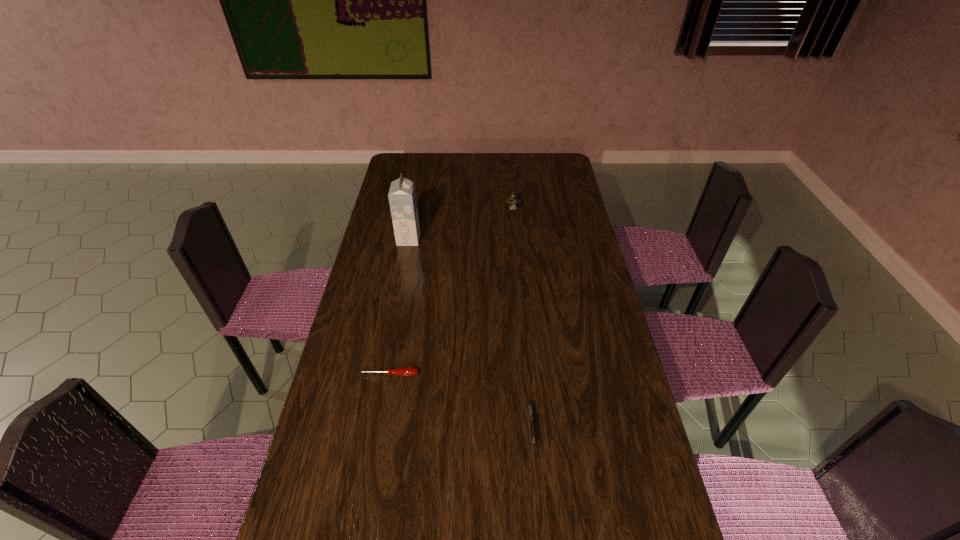
The width and height of the screenshot is (960, 540). In order to click on free space between the farthest object and the nearest object in this screenshot , I will do `click(522, 322)`.

This screenshot has width=960, height=540. Find the location of `free space between the screwdriver and the snail`. free space between the screwdriver and the snail is located at coordinates (451, 292).

I want to click on free space between the nearest object and the screwdriver, so click(x=460, y=404).

The width and height of the screenshot is (960, 540). What are the coordinates of `vacant space in between the tallest object and the snail` in the screenshot? It's located at (461, 225).

The height and width of the screenshot is (540, 960). Find the location of `free space that is in between the snail and the third nearest object`. free space that is in between the snail and the third nearest object is located at coordinates (461, 225).

At what (x,y) coordinates should I click in order to perform the action: click on free spot between the gun and the shortest object. Please return your answer as a coordinate pair (x, y). The height and width of the screenshot is (540, 960). Looking at the image, I should click on (460, 404).

Image resolution: width=960 pixels, height=540 pixels. I want to click on vacant space in between the farthest object and the shortest object, so click(x=451, y=292).

In order to click on vacant area between the gun and the screwdriver in this screenshot , I will do `click(460, 404)`.

Locate an element on the screen. This screenshot has width=960, height=540. object that stands as the third closest to the second shortest object is located at coordinates (513, 201).

At what (x,y) coordinates should I click in order to perform the action: click on object that can be found as the third closest to the snail. Please return your answer as a coordinate pair (x, y). The image size is (960, 540). Looking at the image, I should click on (532, 430).